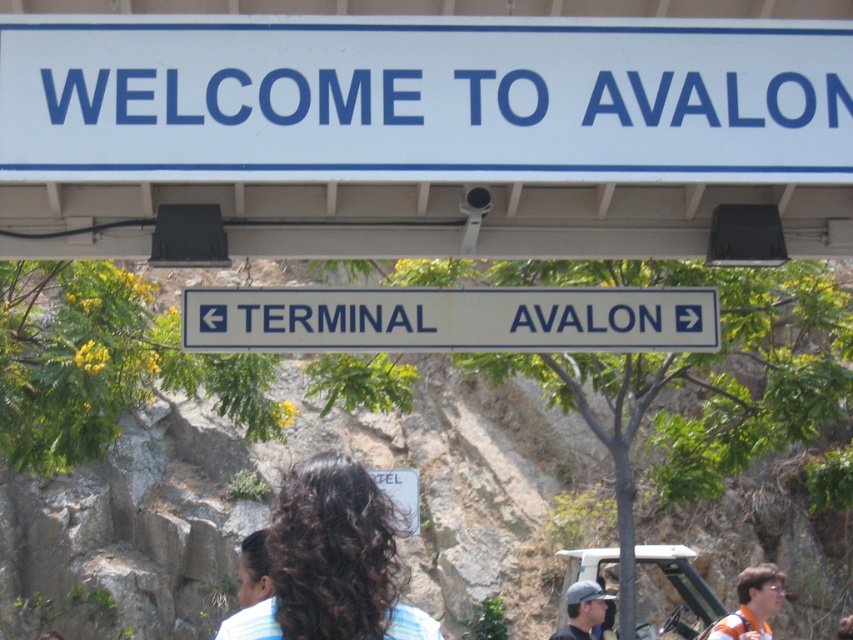
Based on the photo, can you confirm if white plastic sign at center is positioned to the left of orange fabric shirt at lower right?

Yes, white plastic sign at center is to the left of orange fabric shirt at lower right.

Where is `white plastic sign at center`? white plastic sign at center is located at coordinates (450, 320).

Which is behind, point (310, 540) or point (587, 612)?

The point (587, 612) is behind.

Does dark brown curly hair at center have a greater width compared to matte gray cap at lower center?

Correct, the width of dark brown curly hair at center exceeds that of matte gray cap at lower center.

Between point (379, 588) and point (578, 620), which one is positioned behind?

Positioned behind is point (578, 620).

The image size is (853, 640). In order to click on dark brown curly hair at center in this screenshot , I will do `click(332, 561)`.

Is orange fabric shirt at lower right positioned behind dark brown hair at center?

Yes.

Between orange fabric shirt at lower right and dark brown hair at center, which one appears on the right side from the viewer's perspective?

From the viewer's perspective, orange fabric shirt at lower right appears more on the right side.

This screenshot has height=640, width=853. Describe the element at coordinates (752, 604) in the screenshot. I see `orange fabric shirt at lower right` at that location.

Where is `orange fabric shirt at lower right`? orange fabric shirt at lower right is located at coordinates (752, 604).